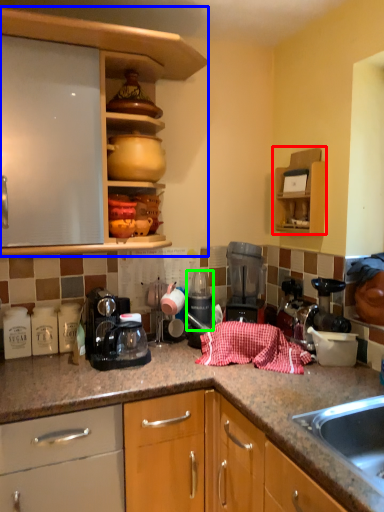
Question: Considering the real-world distances, which object is farthest from cabinetry (highlighted by a red box)? cabinetry (highlighted by a blue box) or appliance (highlighted by a green box)?

Choices:
 (A) cabinetry
 (B) appliance

Answer: (A)